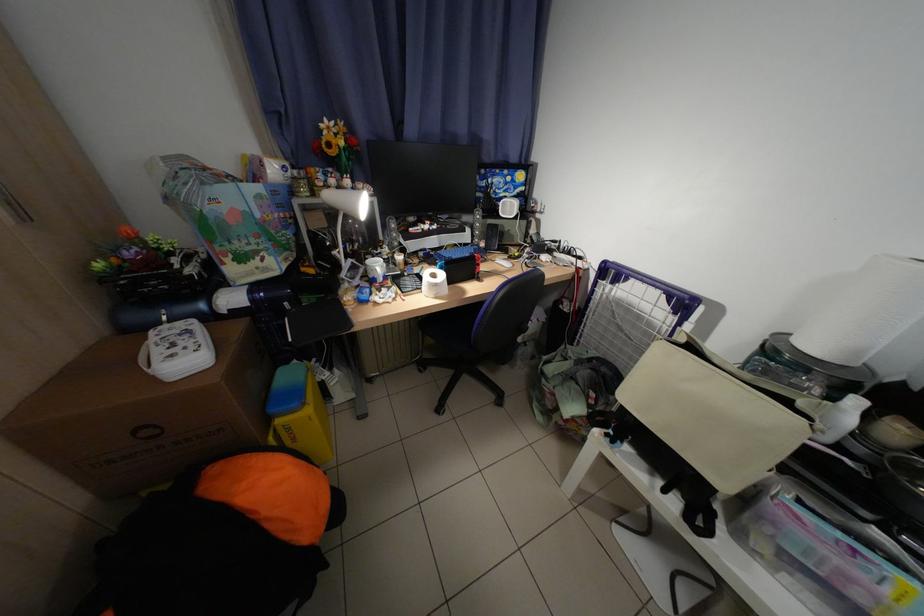
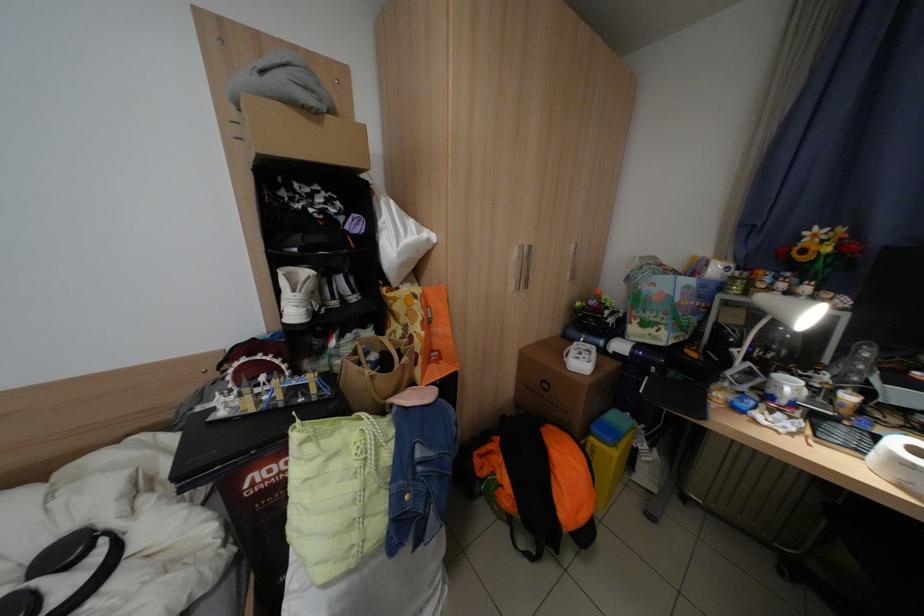
Where in the second image is the point corresponding to pixel 358 265 from the first image?

(752, 366)